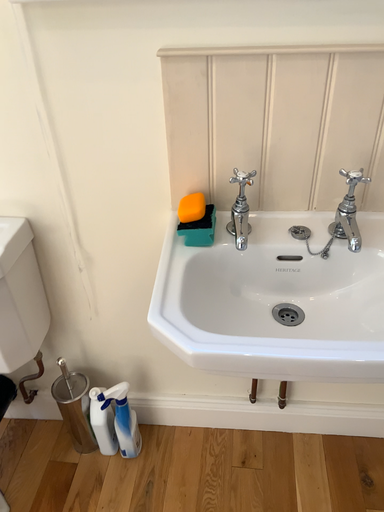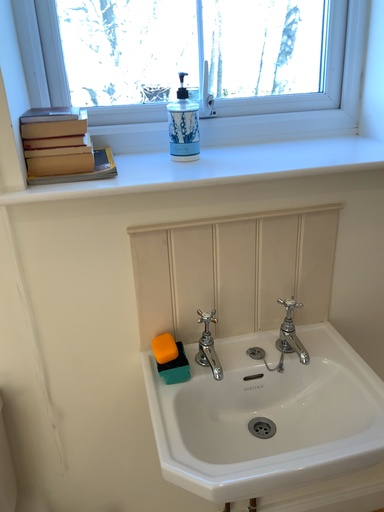
Question: How did the camera likely rotate when shooting the video?

Choices:
 (A) rotated right
 (B) rotated left

Answer: (A)